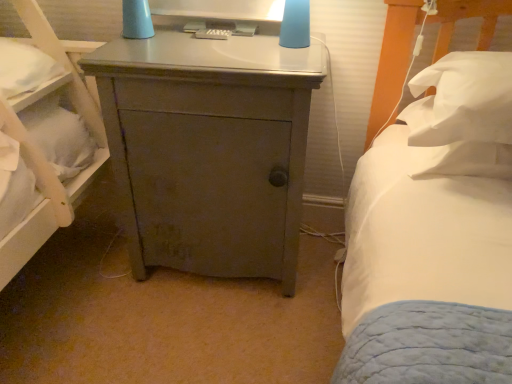
Question: In terms of height, does matte plastic remote control at upper center look taller or shorter compared to white soft pillow at right, placed as the first pillow when sorted from top to bottom?

Choices:
 (A) short
 (B) tall

Answer: (A)

Question: In the image, is matte plastic remote control at upper center positioned in front of or behind white soft pillow at right, placed as the first pillow when sorted from top to bottom?

Choices:
 (A) front
 (B) behind

Answer: (B)

Question: Considering the real-world distances, which object is closest to the white soft pillow at right, marked as the first pillow in a bottom-to-top arrangement?

Choices:
 (A) matte gray cabinet at center
 (B) matte blue lampshade at upper center
 (C) matte plastic remote control at upper center
 (D) white soft pillow at right, placed as the first pillow when sorted from top to bottom

Answer: (D)

Question: Which object is the closest to the matte gray cabinet at center?

Choices:
 (A) white soft pillow at right, which ranks as the second pillow in top-to-bottom order
 (B) matte plastic remote control at upper center
 (C) white soft pillow at right, positioned as the second pillow in bottom-to-top order
 (D) matte blue lampshade at upper center

Answer: (B)